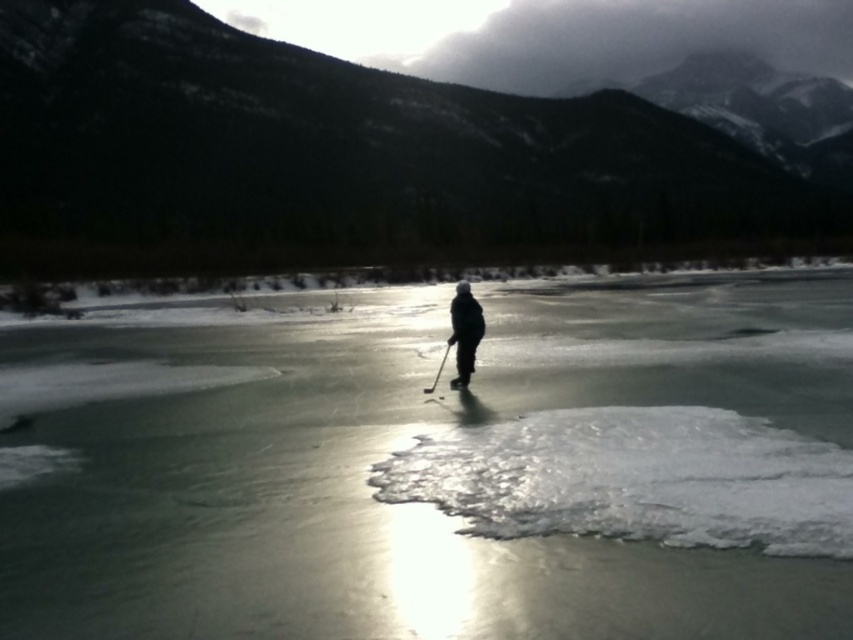
Based on the photo, how far apart are transparent ice at center and black matte jacket at center?

They are 10.23 meters apart.

Which is behind, point (682, 376) or point (463, 385)?

Point (682, 376)

Is point (738, 531) more distant than point (476, 339)?

No, it is in front of (476, 339).

Locate an element on the screen. The width and height of the screenshot is (853, 640). transparent ice at center is located at coordinates (434, 465).

Who is more forward, (833,582) or (438,376)?

Point (833,582) is more forward.

The width and height of the screenshot is (853, 640). What do you see at coordinates (434, 465) in the screenshot? I see `transparent ice at center` at bounding box center [434, 465].

Locate an element on the screen. transparent ice at center is located at coordinates (434, 465).

This screenshot has height=640, width=853. In order to click on transparent ice at center in this screenshot , I will do `click(434, 465)`.

Who is more distant from viewer, (465, 356) or (442, 358)?

Positioned behind is point (442, 358).

Does black matte jacket at center appear on the right side of black plastic ski pole at center?

Correct, you'll find black matte jacket at center to the right of black plastic ski pole at center.

This screenshot has width=853, height=640. Find the location of `black matte jacket at center`. black matte jacket at center is located at coordinates (463, 332).

Where is `black matte jacket at center`? This screenshot has height=640, width=853. black matte jacket at center is located at coordinates (463, 332).